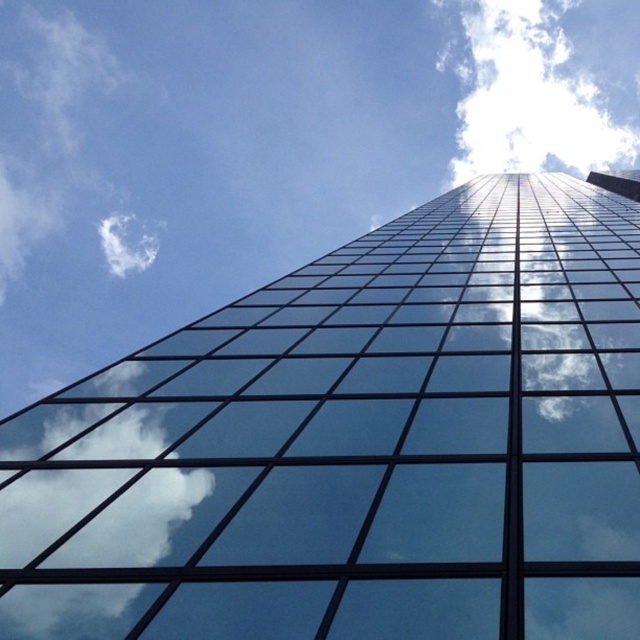
Can you confirm if transparent glass building at center is positioned to the left of white fluffy cloud at upper left?

No, transparent glass building at center is not to the left of white fluffy cloud at upper left.

Between transparent glass building at center and white fluffy cloud at upper left, which one is positioned lower?

Positioned lower is transparent glass building at center.

This screenshot has width=640, height=640. What do you see at coordinates (356, 445) in the screenshot?
I see `transparent glass building at center` at bounding box center [356, 445].

Find the location of a particular element. The height and width of the screenshot is (640, 640). transparent glass building at center is located at coordinates (356, 445).

Who is higher up, white fluffy cloud at upper center or white fluffy cloud at upper left?

white fluffy cloud at upper center is higher up.

Does white fluffy cloud at upper center appear under white fluffy cloud at upper left?

Incorrect, white fluffy cloud at upper center is not positioned below white fluffy cloud at upper left.

Who is more forward, (x=525, y=147) or (x=138, y=257)?

Positioned in front is point (x=525, y=147).

I want to click on white fluffy cloud at upper center, so click(x=528, y=92).

Does transparent glass building at center have a greater height compared to white fluffy cloud at upper center?

In fact, transparent glass building at center may be shorter than white fluffy cloud at upper center.

Is transparent glass building at center smaller than white fluffy cloud at upper center?

Yes.

Locate an element on the screen. transparent glass building at center is located at coordinates (356, 445).

At what (x,y) coordinates should I click in order to perform the action: click on transparent glass building at center. Please return your answer as a coordinate pair (x, y). Image resolution: width=640 pixels, height=640 pixels. Looking at the image, I should click on (356, 445).